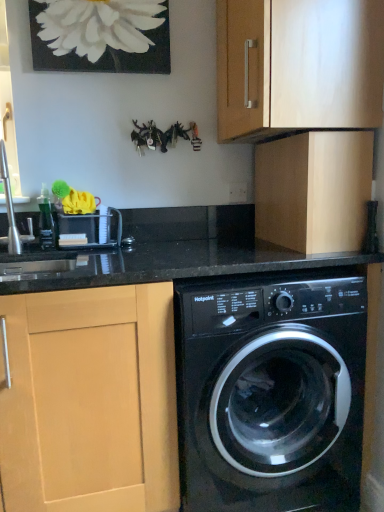
Question: Considering the positions of point (256, 335) and point (317, 117), is point (256, 335) closer or farther from the camera than point (317, 117)?

Choices:
 (A) closer
 (B) farther

Answer: (A)

Question: Considering the relative positions of black glossy washing machine at lower center and matte wood cabinet at upper center, which is counted as the 1th cabinetry, starting from the top, in the image provided, is black glossy washing machine at lower center to the left or to the right of matte wood cabinet at upper center, which is counted as the 1th cabinetry, starting from the top,?

Choices:
 (A) right
 (B) left

Answer: (B)

Question: Which of these objects is positioned closest to the white matte painting at upper center?

Choices:
 (A) matte wood cabinet at upper center, which is counted as the 1th cabinetry, starting from the top
 (B) light wood cabinet at upper right, which is the 3th cabinetry from left to right
 (C) light wood cabinet at left, the 3th cabinetry positioned from the top
 (D) black glossy washing machine at lower center
 (E) brushed metal faucet at left

Answer: (A)

Question: Which object is positioned closest to the light wood cabinet at left, which ranks as the third cabinetry in right-to-left order?

Choices:
 (A) matte wood cabinet at upper center, acting as the 2th cabinetry starting from the right
 (B) black glossy washing machine at lower center
 (C) brushed metal faucet at left
 (D) white matte painting at upper center
 (E) light wood cabinet at upper right, the 2th cabinetry in the top-to-bottom sequence

Answer: (B)